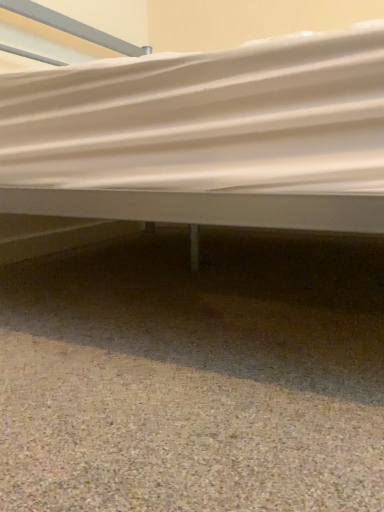
Question: Considering the positions of point (97, 387) and point (327, 95), is point (97, 387) closer or farther from the camera than point (327, 95)?

Choices:
 (A) farther
 (B) closer

Answer: (A)

Question: Considering the positions of brown gravel at lower center and white fabric bed at center in the image, is brown gravel at lower center taller or shorter than white fabric bed at center?

Choices:
 (A) tall
 (B) short

Answer: (B)

Question: Looking at the image, does brown gravel at lower center seem bigger or smaller compared to white fabric bed at center?

Choices:
 (A) big
 (B) small

Answer: (B)

Question: Considering the positions of white fabric bed at center and brown gravel at lower center in the image, is white fabric bed at center wider or thinner than brown gravel at lower center?

Choices:
 (A) thin
 (B) wide

Answer: (B)

Question: From a real-world perspective, is white fabric bed at center above or below brown gravel at lower center?

Choices:
 (A) below
 (B) above

Answer: (B)

Question: From their relative heights in the image, would you say white fabric bed at center is taller or shorter than brown gravel at lower center?

Choices:
 (A) tall
 (B) short

Answer: (A)

Question: In the image, is white fabric bed at center positioned in front of or behind brown gravel at lower center?

Choices:
 (A) front
 (B) behind

Answer: (B)